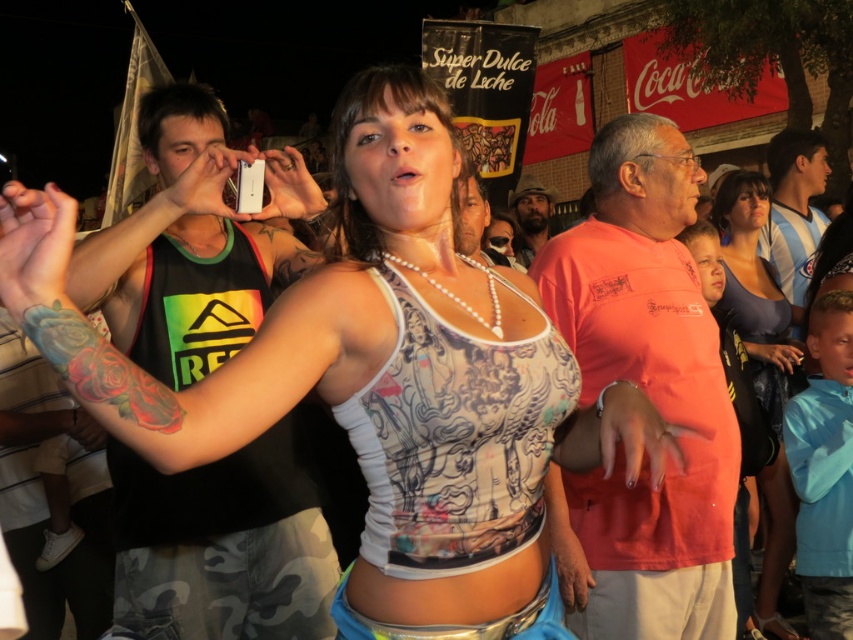
Is black tank top at left positioned at the back of matte blue tank top at center?

No, black tank top at left is in front of matte blue tank top at center.

Who is positioned more to the right, black tank top at left or matte blue tank top at center?

matte blue tank top at center

At what (x,y) coordinates should I click in order to perform the action: click on black tank top at left. Please return your answer as a coordinate pair (x, y). This screenshot has width=853, height=640. Looking at the image, I should click on (192, 244).

Image resolution: width=853 pixels, height=640 pixels. Find the location of `black tank top at left`. black tank top at left is located at coordinates (192, 244).

Who is positioned more to the right, orange cotton shirt at center or beige fabric hat at upper center?

beige fabric hat at upper center is more to the right.

The height and width of the screenshot is (640, 853). What are the coordinates of `orange cotton shirt at center` in the screenshot? It's located at (647, 396).

I want to click on orange cotton shirt at center, so click(x=647, y=396).

Does matte blue tank top at center have a lesser width compared to beige fabric hat at upper center?

Correct, matte blue tank top at center's width is less than beige fabric hat at upper center's.

Measure the distance between point [766,326] and camera.

Point [766,326] is 40.68 feet from camera.

Where is `matte blue tank top at center`? matte blue tank top at center is located at coordinates (759, 364).

At what (x,y) coordinates should I click in order to perform the action: click on matte blue tank top at center. Please return your answer as a coordinate pair (x, y). The height and width of the screenshot is (640, 853). Looking at the image, I should click on (759, 364).